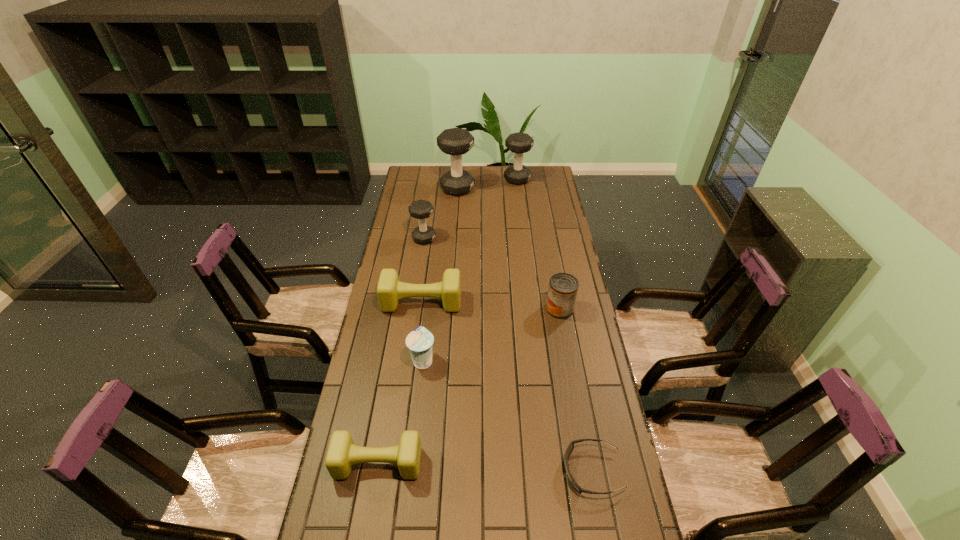
Find the location of a particular element. The width and height of the screenshot is (960, 540). vacant region located on the back of the yogurt is located at coordinates (429, 308).

Locate an element on the screen. This screenshot has width=960, height=540. blank space located on the right of the smaller olive dumbbell is located at coordinates click(x=505, y=463).

Image resolution: width=960 pixels, height=540 pixels. I want to click on vacant point located 0.350m on the lenses of the goggles, so click(x=438, y=471).

In order to click on vacant point located on the lenses of the goggles in this screenshot , I will do `click(545, 471)`.

The width and height of the screenshot is (960, 540). What are the coordinates of `free space located 0.100m on the lenses of the goggles` in the screenshot? It's located at (527, 471).

Where is `yogurt located at the left edge`? Image resolution: width=960 pixels, height=540 pixels. yogurt located at the left edge is located at coordinates (419, 341).

Locate an element on the screen. Image resolution: width=960 pixels, height=540 pixels. dumbbell present at the right edge is located at coordinates (518, 143).

Locate an element on the screen. This screenshot has width=960, height=540. can positioned at the right edge is located at coordinates (563, 287).

The width and height of the screenshot is (960, 540). Find the location of `goggles present at the right edge`. goggles present at the right edge is located at coordinates (570, 447).

Where is `object situated at the far right corner`? object situated at the far right corner is located at coordinates (518, 143).